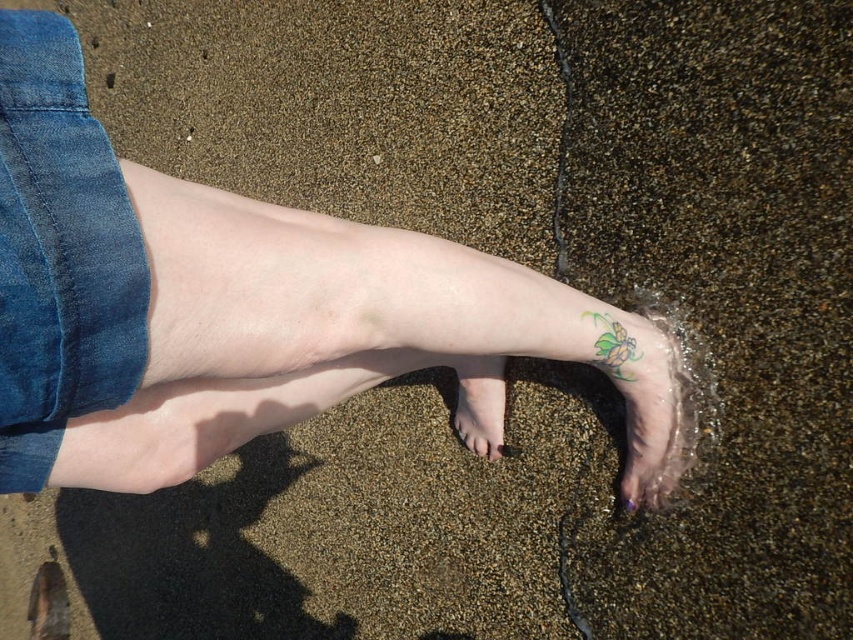
You are a photographer setting up a shoot on the beach. You want to capture both the multicolored tattooed foot at lower right and the matte skin toe at lower center in the same frame. Given that your camera has a maximum focus range of 10 inches, will you be able to focus on both subjects simultaneously?

The multicolored tattooed foot at lower right and the matte skin toe at lower center are 9.86 inches apart, which is within the camera maximum focus range of 10 inches. Therefore, the camera can focus on both subjects simultaneously.

You are a photographer trying to capture the multicolored tattooed foot at lower right and the matte skin toe at lower center in a clear shot. Which object is closer to the camera?

The multicolored tattooed foot at lower right is closer to the camera because it is in front of the matte skin toe at lower center.

You are standing 16.96 inches away from the point at coordinates point (45, 225). If you want to place a small pebble there, will you be able to do so without moving your current position?

Yes, because the distance between you and point (45, 225) is exactly 16.96 inches, so you can reach it from your current position.